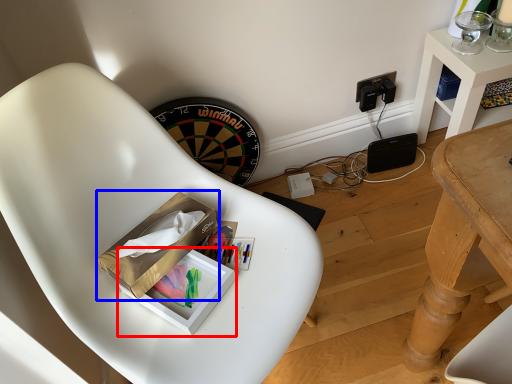
Question: Among these objects, which one is nearest to the camera, box (highlighted by a red box) or cardboard box (highlighted by a blue box)?

Choices:
 (A) box
 (B) cardboard box

Answer: (B)